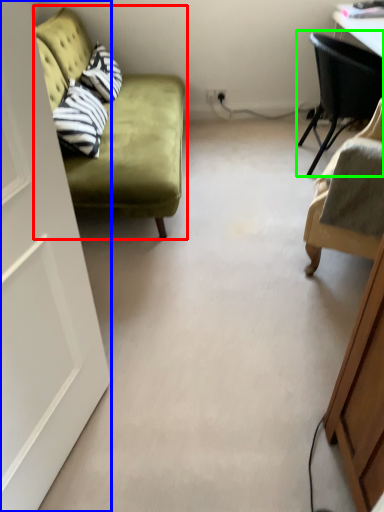
Question: Which object is the farthest from studio couch (highlighted by a red box)? Choose among these: door (highlighted by a blue box) or chair (highlighted by a green box).

Choices:
 (A) door
 (B) chair

Answer: (A)